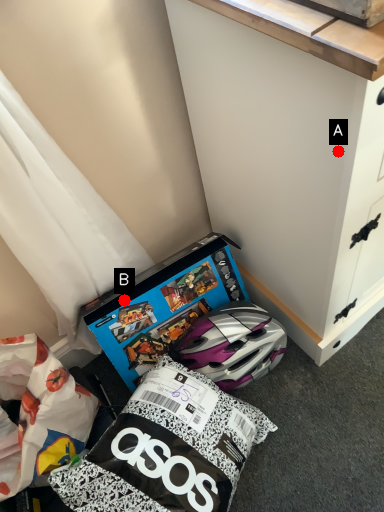
Question: Two points are circled on the image, labeled by A and B beside each circle. Among these points, which one is nearest to the camera?

Choices:
 (A) A is closer
 (B) B is closer

Answer: (A)